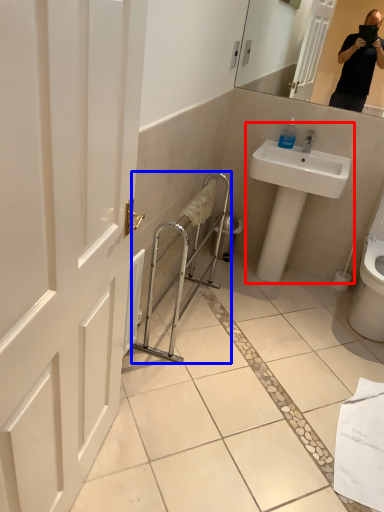
Question: Among these objects, which one is nearest to the camera, sink (highlighted by a red box) or balustrade (highlighted by a blue box)?

Choices:
 (A) sink
 (B) balustrade

Answer: (B)